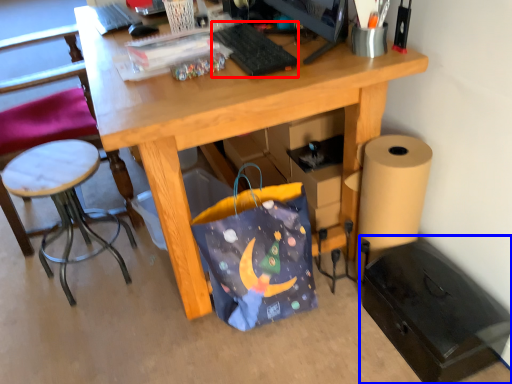
Question: Which point is further to the camera, keyboard (highlighted by a red box) or file cabinet (highlighted by a blue box)?

Choices:
 (A) keyboard
 (B) file cabinet

Answer: (A)